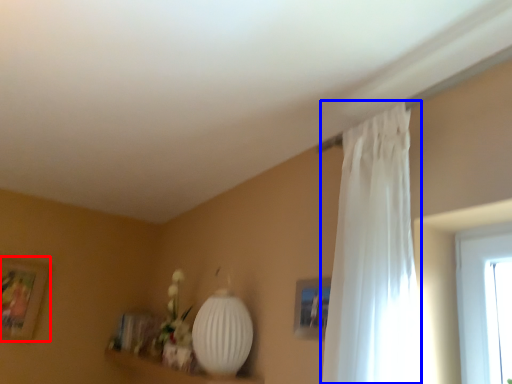
Question: Which of the following is the farthest to the observer, picture frame (highlighted by a red box) or curtain (highlighted by a blue box)?

Choices:
 (A) picture frame
 (B) curtain

Answer: (A)